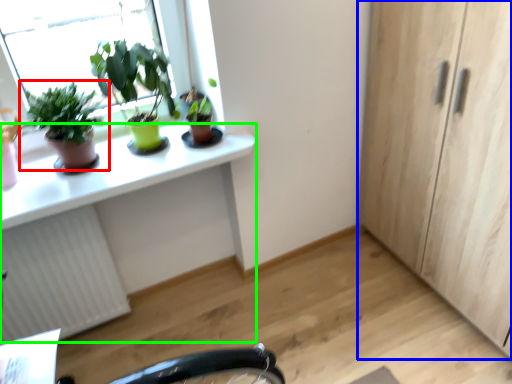
Question: Estimate the real-world distances between objects in this image. Which object is farther from houseplant (highlighted by a red box), cabinetry (highlighted by a blue box) or computer desk (highlighted by a green box)?

Choices:
 (A) cabinetry
 (B) computer desk

Answer: (A)